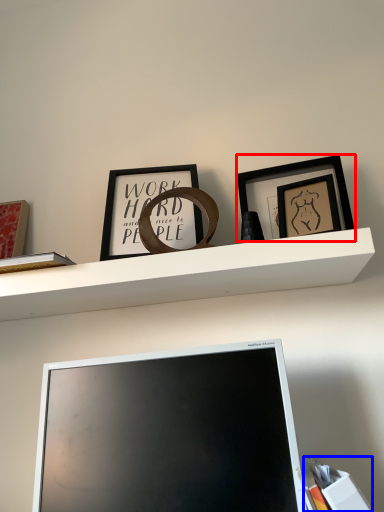
Question: Which point is further to the camera, picture frame (highlighted by a red box) or book (highlighted by a blue box)?

Choices:
 (A) picture frame
 (B) book

Answer: (A)